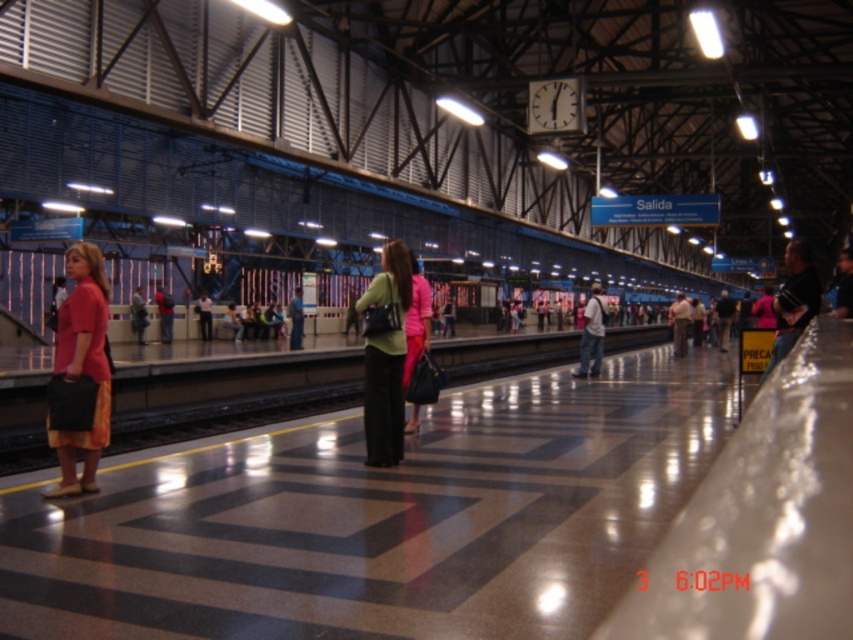
You are at the train station and see two people wearing pink shirts. The first person is wearing a matte pink shirt at left, and the second is wearing a light pink shirt at center. Which person is standing more to the left side of the platform?

The matte pink shirt at left is positioned on the left side of the light pink shirt at center, so the person wearing the matte pink shirt at left is standing more to the left side of the platform.

You are standing on the train station platform and want to walk from point [135,298] to point [199,321]. Which direction should you move in to get there?

You should move towards the upper right direction because point [199,321] is located in the upper right relative to point [135,298].